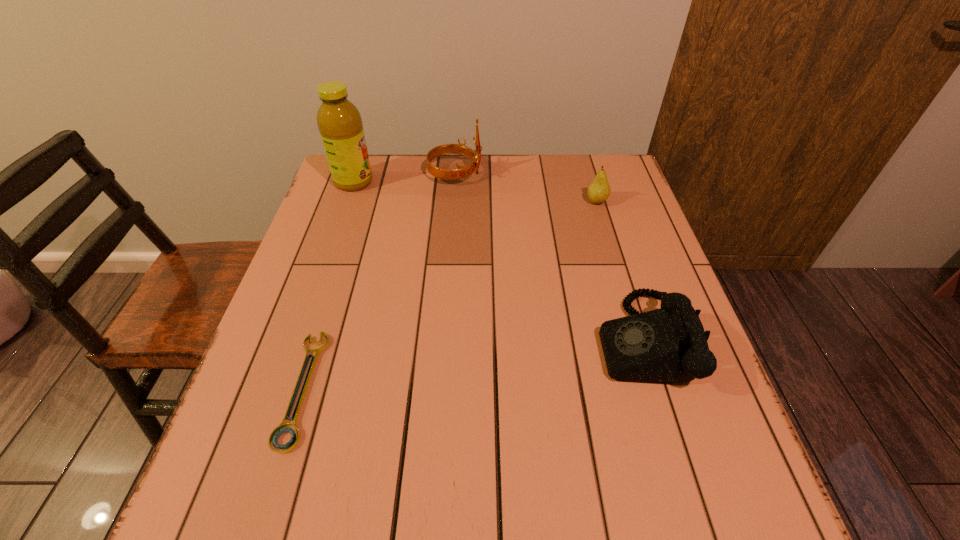
Find the location of a particular element. empty space between the fourth shortest object and the fruit juice is located at coordinates (404, 178).

What are the coordinates of `empty space that is in between the telephone and the shortest object` in the screenshot? It's located at (471, 364).

Locate an element on the screen. vacant point located between the telephone and the wrench is located at coordinates (471, 364).

Where is `empty space that is in between the telephone and the tallest object`? The image size is (960, 540). empty space that is in between the telephone and the tallest object is located at coordinates (497, 261).

Identify the location of vacant area between the telephone and the fruit juice. The height and width of the screenshot is (540, 960). (497, 261).

The height and width of the screenshot is (540, 960). Find the location of `vacant space that is in between the telephone and the fruit juice`. vacant space that is in between the telephone and the fruit juice is located at coordinates (497, 261).

The width and height of the screenshot is (960, 540). Identify the location of empty space that is in between the wrench and the tallest object. (328, 285).

I want to click on object that is the third closest to the third nearest object, so click(339, 122).

Find the location of `object that is the nearest to the fourth shortest object`. object that is the nearest to the fourth shortest object is located at coordinates (339, 122).

Image resolution: width=960 pixels, height=540 pixels. Identify the location of free space that satisfies the following two spatial constraints: 1. on the front label of the fruit juice; 2. on the back side of the pear. (347, 202).